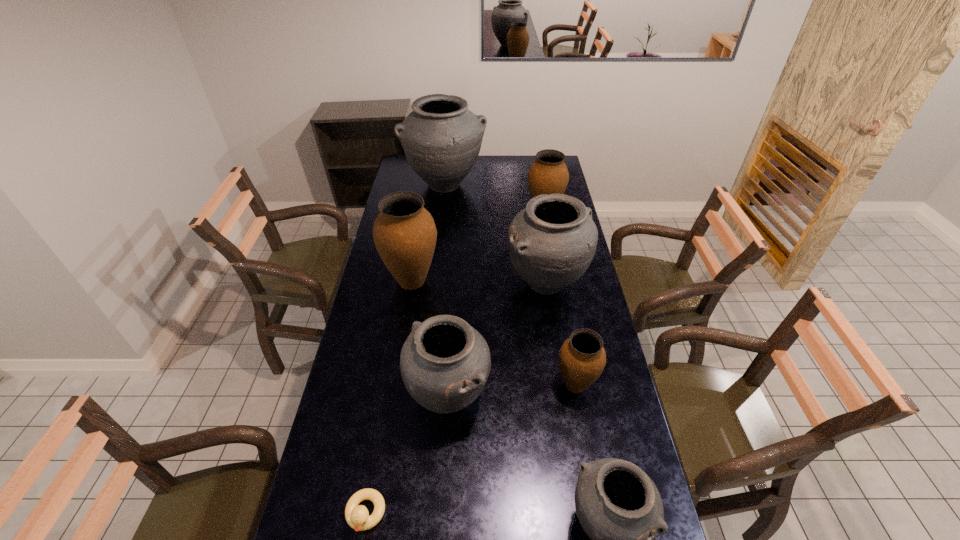
Find the location of a particular element. Image resolution: width=960 pixels, height=540 pixels. vacant area situated 0.320m on the back of the third nearest black urn is located at coordinates (535, 214).

What are the coordinates of `vacant space located 0.170m on the front of the farthest brown urn` in the screenshot? It's located at (x=550, y=246).

Find the location of a particular element. The height and width of the screenshot is (540, 960). vacant region located on the right of the second nearest black urn is located at coordinates (512, 396).

Identify the location of vacant region located 0.270m on the left of the smallest brown urn. This screenshot has width=960, height=540. (471, 385).

Locate an element on the screen. object present at the far edge is located at coordinates (441, 137).

Identify the location of duckling present at the left edge. (357, 516).

At what (x,y) coordinates should I click in order to perform the action: click on object at the far left corner. Please return your answer as a coordinate pair (x, y). This screenshot has height=540, width=960. Looking at the image, I should click on (441, 137).

You are a GUI agent. You are given a task and a screenshot of the screen. Output one action in this format:
    pyautogui.click(x=<x>, y=<y>)
    Task: Click on the free space at the left edge
    The width and height of the screenshot is (960, 540).
    Given the screenshot: What is the action you would take?
    pyautogui.click(x=388, y=318)

Identify the location of free space at the right edge of the desktop. (563, 303).

In the image, there is a desktop. Where is `blank space at the far left corner`? blank space at the far left corner is located at coordinates (405, 158).